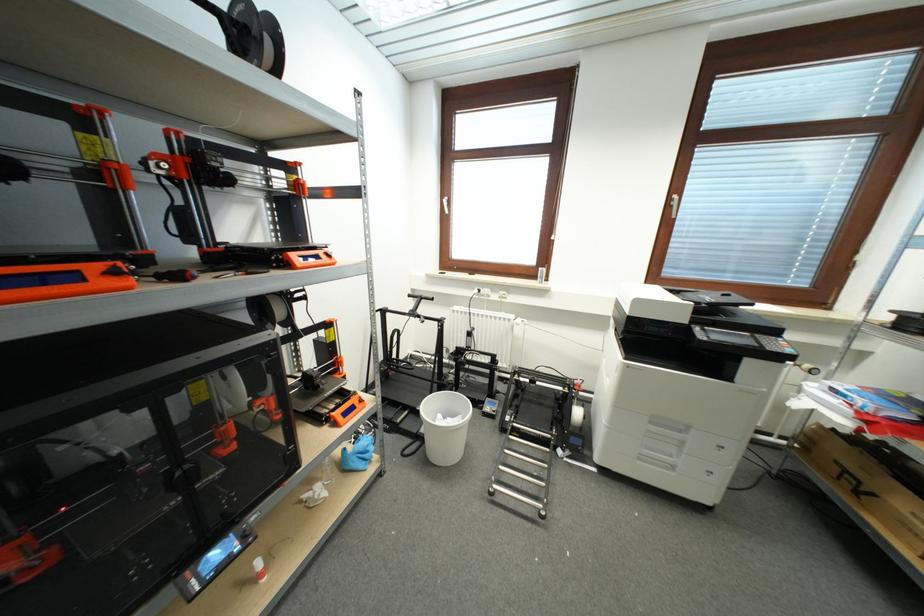
The width and height of the screenshot is (924, 616). I want to click on white filament spool, so click(x=444, y=426).